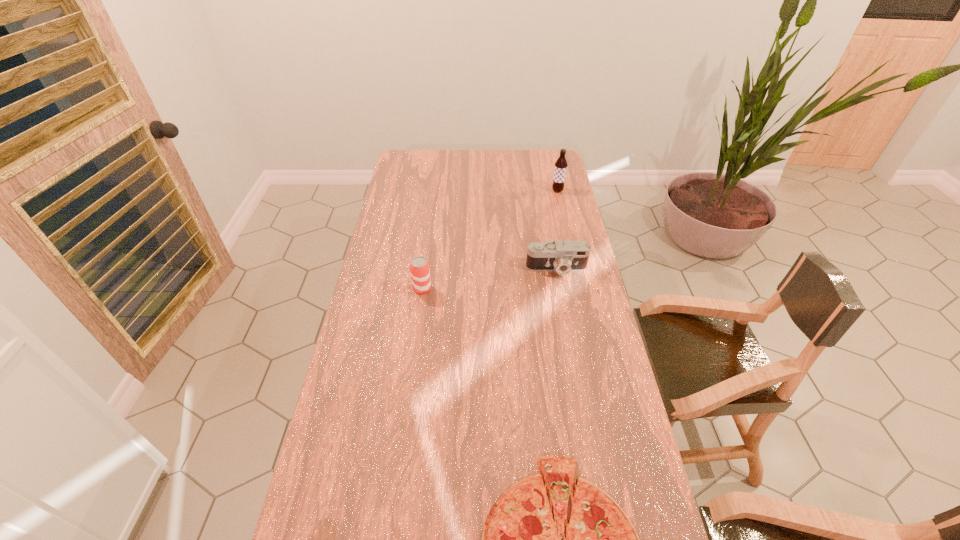
At what (x,y) coordinates should I click in order to perform the action: click on the tallest object. Please return your answer as a coordinate pair (x, y). The image size is (960, 540). Looking at the image, I should click on (560, 169).

Find the location of a particular element. This screenshot has width=960, height=540. the farthest object is located at coordinates (560, 169).

I want to click on the third farthest object, so click(419, 267).

Where is `the leftmost object`? This screenshot has width=960, height=540. the leftmost object is located at coordinates (419, 267).

Where is `camera`? The width and height of the screenshot is (960, 540). camera is located at coordinates (570, 255).

Image resolution: width=960 pixels, height=540 pixels. I want to click on the second farthest object, so click(x=570, y=255).

The image size is (960, 540). Identify the location of vacant space located on the front of the root beer. (561, 203).

Find the location of a particular element. The width and height of the screenshot is (960, 540). vacant space located on the back of the third shortest object is located at coordinates (427, 253).

Identify the location of vacant position located 0.200m on the lens of the third tallest object. (566, 320).

Find the location of a particular element. The height and width of the screenshot is (540, 960). root beer at the right edge is located at coordinates (560, 169).